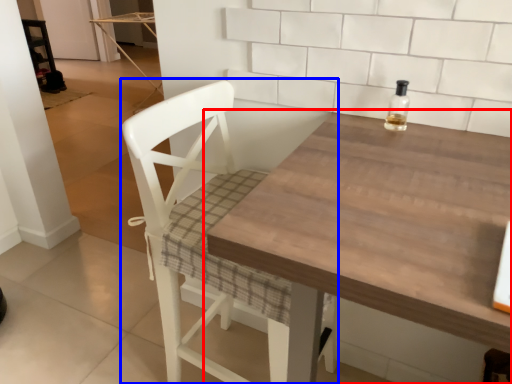
Question: Which object is further to the camera taking this photo, table (highlighted by a red box) or chair (highlighted by a blue box)?

Choices:
 (A) table
 (B) chair

Answer: (B)